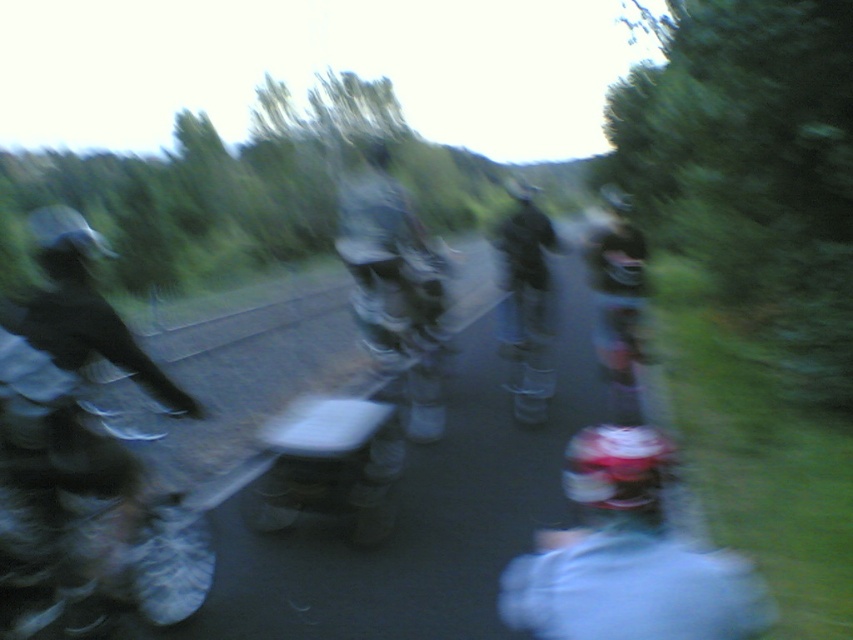
Question: Is metallic silver motorcycle at left wider than white matte helmet at center?

Choices:
 (A) yes
 (B) no

Answer: (B)

Question: Is metallic silver motorcycle at left bigger than white matte helmet at center?

Choices:
 (A) no
 (B) yes

Answer: (B)

Question: Which object is farther from the camera taking this photo?

Choices:
 (A) metallic silver motorcycle at left
 (B) white matte helmet at center

Answer: (A)

Question: Is metallic silver motorcycle at left above white matte helmet at center?

Choices:
 (A) no
 (B) yes

Answer: (B)